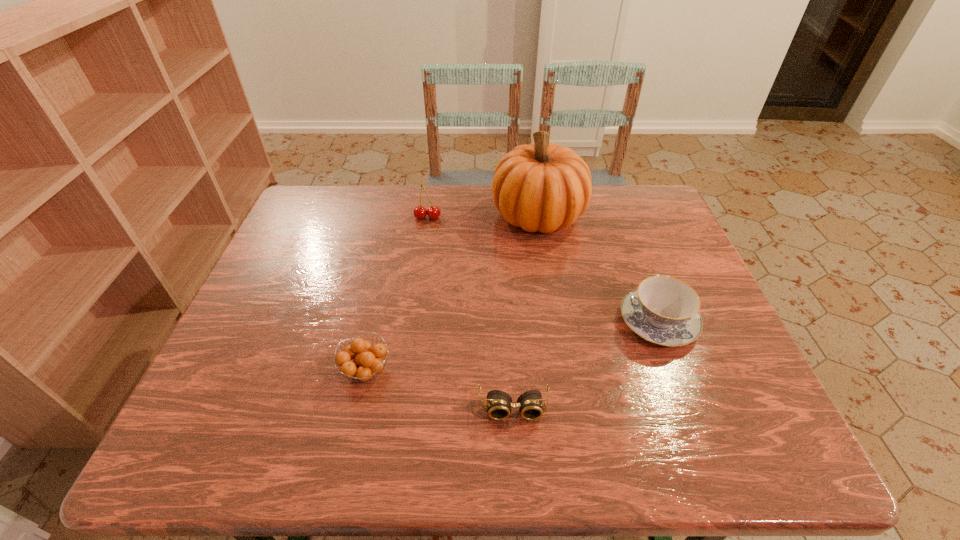
Identify the location of unoccupied area between the cherry and the goggles. Image resolution: width=960 pixels, height=540 pixels. (470, 313).

Select which object appears as the fourth closest to the goggles. Please provide its 2D coordinates. Your answer should be formatted as a tuple, i.e. [(x, y)], where the tuple contains the x and y coordinates of a point satisfying the conditions above.

[(420, 212)]

Identify which object is the nearest to the second tallest object. Please provide its 2D coordinates. Your answer should be formatted as a tuple, i.e. [(x, y)], where the tuple contains the x and y coordinates of a point satisfying the conditions above.

[(544, 187)]